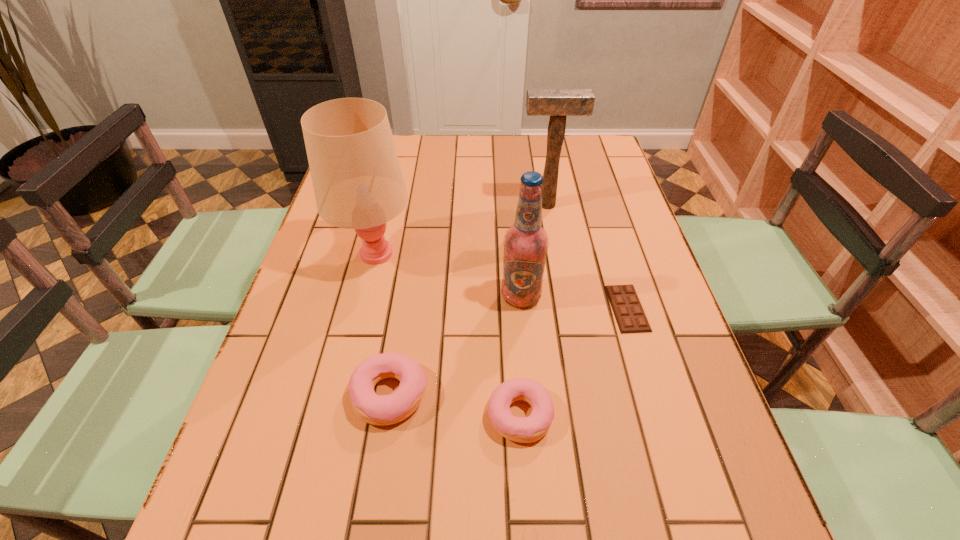
Where is `vacant place for an extra doughnut on the right`? The image size is (960, 540). vacant place for an extra doughnut on the right is located at coordinates (659, 437).